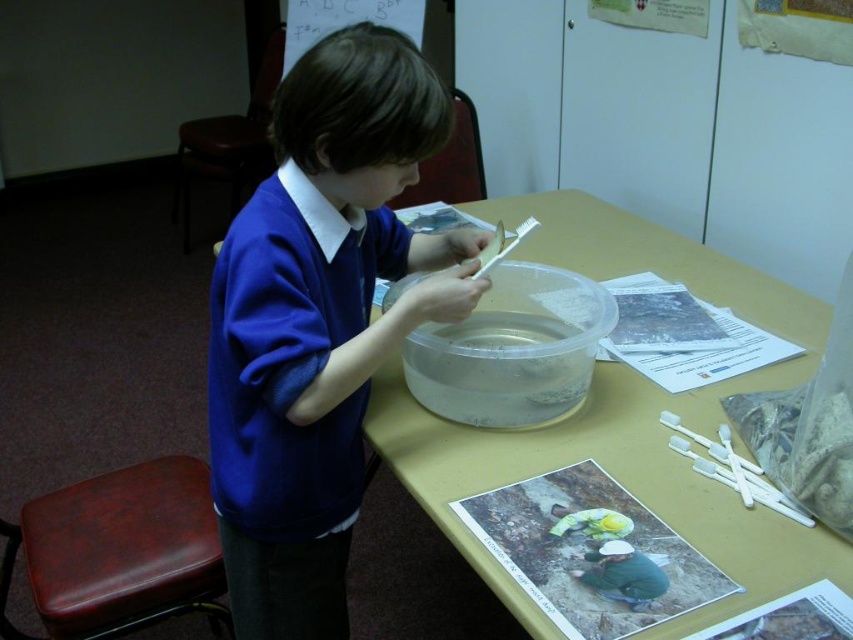
Does point (285, 598) come farther from viewer compared to point (482, 474)?

Yes, it is.

Who is more distant from viewer, (x=335, y=477) or (x=610, y=417)?

Point (x=610, y=417)

Which is in front, point (288, 192) or point (593, 419)?

Point (288, 192)

At what (x,y) coordinates should I click in order to perform the action: click on blue fabric shirt at center. Please return your answer as a coordinate pair (x, y). Looking at the image, I should click on (318, 321).

Does translucent plastic table at center have a larger size compared to brown leather stool at lower left?

Yes.

Which of these two, translucent plastic table at center or brown leather stool at lower left, stands taller?

translucent plastic table at center is taller.

Image resolution: width=853 pixels, height=640 pixels. I want to click on translucent plastic table at center, so click(622, 419).

Who is lower down, blue fabric shirt at center or brown leather stool at lower left?

brown leather stool at lower left

Is point (398, 40) behind point (44, 547)?

No, it is in front of (44, 547).

Is point (335, 61) closer to camera compared to point (83, 605)?

That is True.

You are a GUI agent. You are given a task and a screenshot of the screen. Output one action in this format:
    pyautogui.click(x=<x>, y=<y>)
    Task: Click on the blue fabric shirt at center
    
    Given the screenshot: What is the action you would take?
    pyautogui.click(x=318, y=321)